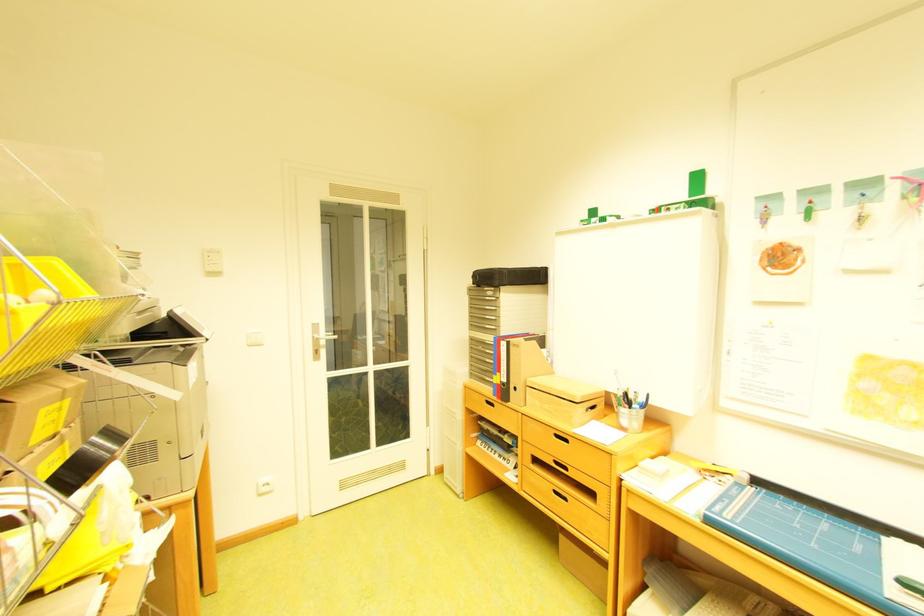
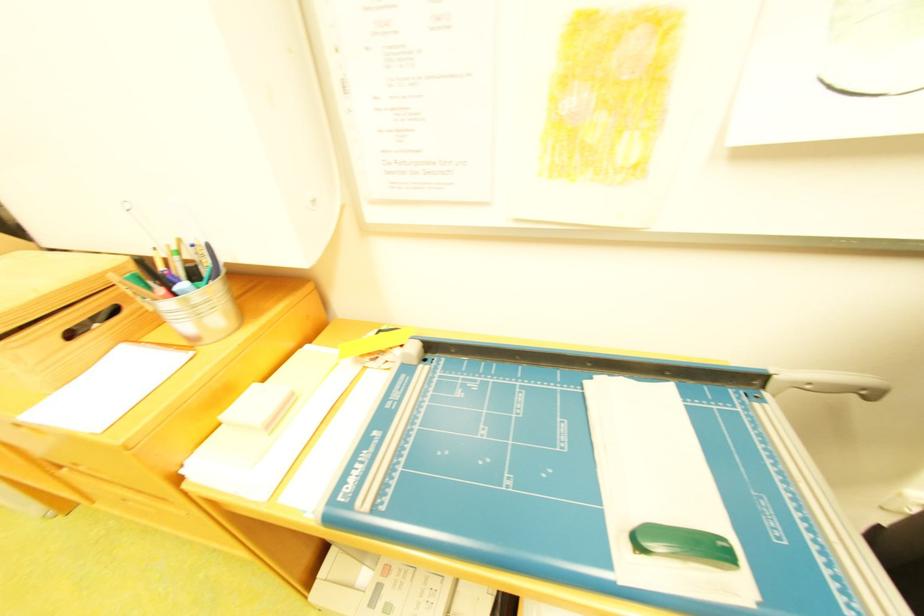
Question: I am providing you with two images of the same scene from different viewpoints. Please identify which objects are invisible in image2.

Choices:
 (A) wooden drawer handle
 (B) green sliding handle
 (C) metal pen holder
 (D) gold zipper pull

Answer: (A)